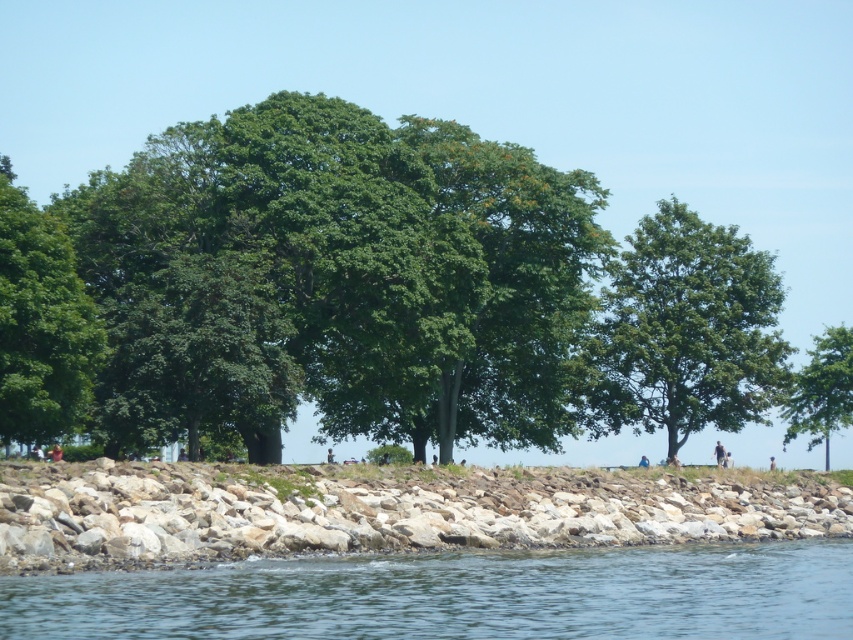
You are standing at the edge of the lake and see a point marked at coordinates (380, 509). Based on the scene description, where exactly is this point located?

The point is located on the gray rocky stone at lower center.

You are standing at the lakeside and want to take a photo of the green leafy tree at right without the light blue jeans at center appearing in the frame. Is it possible to do so given their distance?

The green leafy tree at right is 7.49 meters away from light blue jeans at center. Since the distance between them is relatively large, you can position yourself or adjust your camera angle to exclude the light blue jeans at center from the frame, making it possible to capture the tree without the jeans appearing in the photo.

In the scene shown: You are standing at the lakeside and want to reach the point marked as point (149,630). Given that the distance from you to that point is 28.04 meters, can you estimate how far you need to walk to reach it?

You need to walk approximately 28.04 meters to reach the point (149,630) since it is 28.04 meters away from your current position.